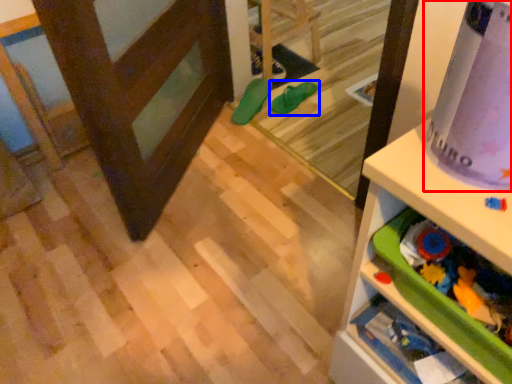
Question: Among these objects, which one is nearest to the camera, wrapping paper (highlighted by a red box) or footwear (highlighted by a blue box)?

Choices:
 (A) wrapping paper
 (B) footwear

Answer: (A)